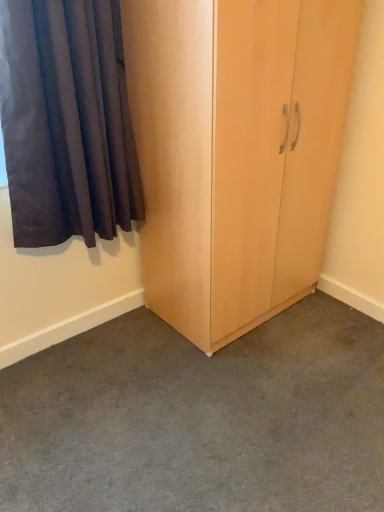
Question: From a real-world perspective, is dark blue fabric curtain at left located beneath light wood cupboard at center?

Choices:
 (A) no
 (B) yes

Answer: (A)

Question: Is dark blue fabric curtain at left oriented away from light wood cupboard at center?

Choices:
 (A) no
 (B) yes

Answer: (A)

Question: Can you confirm if dark blue fabric curtain at left is wider than light wood cupboard at center?

Choices:
 (A) yes
 (B) no

Answer: (B)

Question: Can you confirm if dark blue fabric curtain at left is taller than light wood cupboard at center?

Choices:
 (A) yes
 (B) no

Answer: (B)

Question: Does dark blue fabric curtain at left come behind light wood cupboard at center?

Choices:
 (A) no
 (B) yes

Answer: (A)

Question: Is dark blue fabric curtain at left not within light wood cupboard at center?

Choices:
 (A) no
 (B) yes

Answer: (B)

Question: From a real-world perspective, is carpeted floor at center on top of dark blue fabric curtain at left?

Choices:
 (A) no
 (B) yes

Answer: (A)

Question: From the image's perspective, is carpeted floor at center beneath dark blue fabric curtain at left?

Choices:
 (A) no
 (B) yes

Answer: (B)

Question: Does carpeted floor at center have a smaller size compared to dark blue fabric curtain at left?

Choices:
 (A) no
 (B) yes

Answer: (A)

Question: Is carpeted floor at center further to the viewer compared to dark blue fabric curtain at left?

Choices:
 (A) no
 (B) yes

Answer: (A)

Question: Is carpeted floor at center taller than dark blue fabric curtain at left?

Choices:
 (A) yes
 (B) no

Answer: (B)

Question: Does carpeted floor at center have a lesser width compared to dark blue fabric curtain at left?

Choices:
 (A) no
 (B) yes

Answer: (A)

Question: Considering the relative positions of light wood cupboard at center and dark blue fabric curtain at left in the image provided, is light wood cupboard at center behind dark blue fabric curtain at left?

Choices:
 (A) yes
 (B) no

Answer: (A)